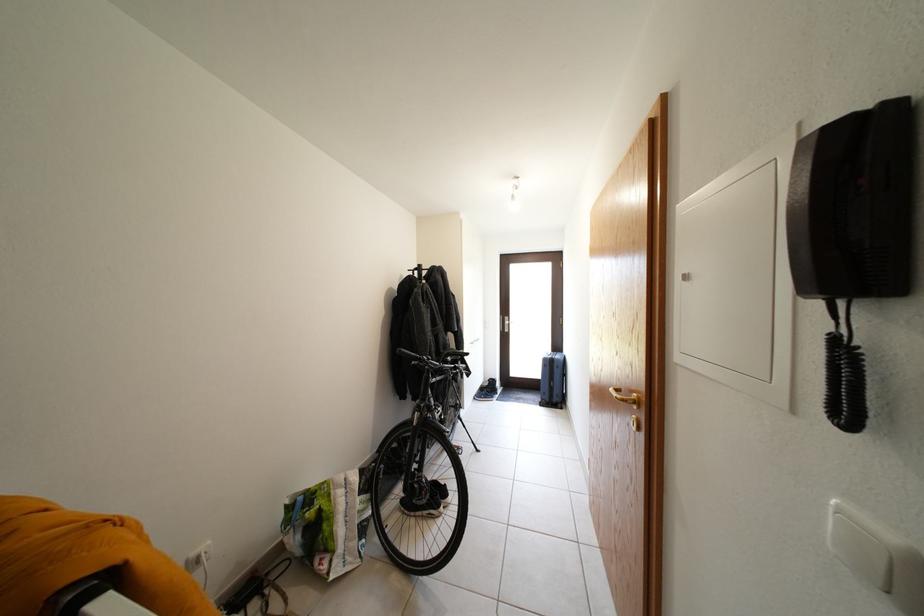
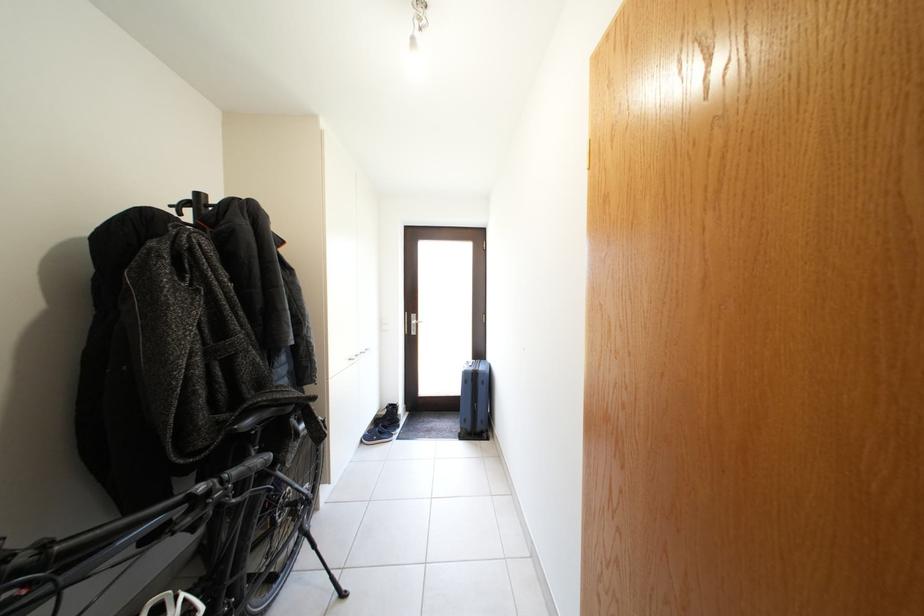
Find the pixel in the second image that matches point 428,270 in the first image.

(205, 200)